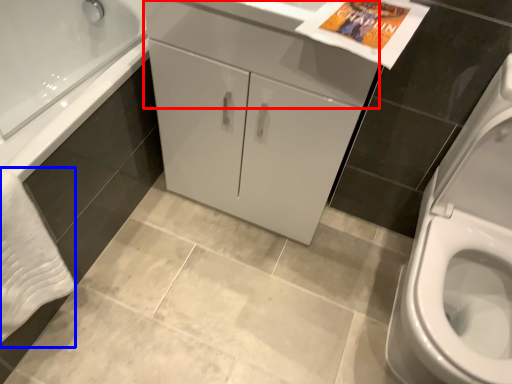
Question: Which point is closer to the camera, drawer (highlighted by a red box) or bath towel (highlighted by a blue box)?

Choices:
 (A) drawer
 (B) bath towel

Answer: (B)